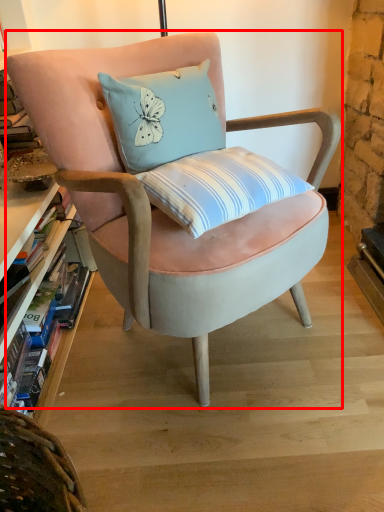
Question: From the image's perspective, what is the correct spatial relationship of chair (annotated by the red box) in relation to book?

Choices:
 (A) below
 (B) above

Answer: (B)